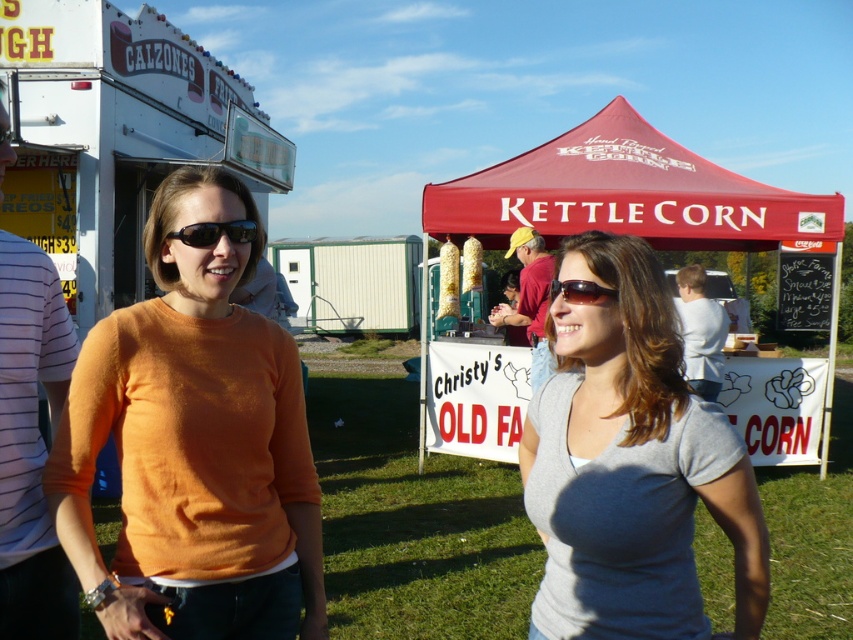
Question: Can you confirm if maroon fabric canopy at upper center is positioned to the right of black plastic sunglasses at center?

Choices:
 (A) yes
 (B) no

Answer: (A)

Question: Is the position of white striped shirt at left less distant than that of black plastic sunglasses at left?

Choices:
 (A) yes
 (B) no

Answer: (B)

Question: Which object is farther from the camera taking this photo?

Choices:
 (A) matte yellow shirt at center
 (B) white striped shirt at left

Answer: (A)

Question: Which object appears closest to the camera in this image?

Choices:
 (A) matte yellow shirt at center
 (B) black plastic sunglasses at left

Answer: (B)

Question: Does gray matte shirt at center lie in front of white cotton shirt at center?

Choices:
 (A) yes
 (B) no

Answer: (A)

Question: Based on their relative distances, which object is farther from the gray matte shirt at center?

Choices:
 (A) black plastic sunglasses at center
 (B) maroon fabric tent at center
 (C) maroon fabric canopy at upper center

Answer: (C)